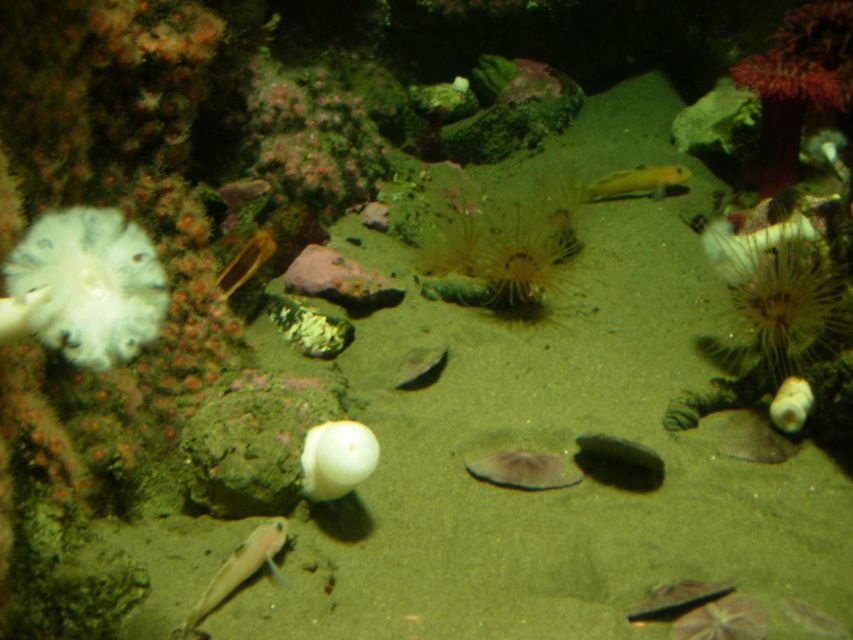
From the picture: Measure the distance between translucent pink fish at lower left and camera.

translucent pink fish at lower left is 1.30 meters away from camera.

Who is higher up, translucent pink fish at lower left or shiny silver fish at lower center?

translucent pink fish at lower left is higher up.

Describe the element at coordinates (236, 572) in the screenshot. This screenshot has height=640, width=853. I see `translucent pink fish at lower left` at that location.

Identify the location of translucent pink fish at lower left. This screenshot has height=640, width=853. (236, 572).

Can you confirm if white soft coral at left is positioned to the left of shiny silver fish at lower center?

Yes, white soft coral at left is to the left of shiny silver fish at lower center.

Is point (80, 326) more distant than point (679, 580)?

Yes, point (80, 326) is farther from viewer.

Find the location of `white soft coral at left`. white soft coral at left is located at coordinates (90, 284).

Does white matte coral at center appear on the left side of yellow-green glossy fish at upper right?

Yes, white matte coral at center is to the left of yellow-green glossy fish at upper right.

Who is more distant from viewer, (363, 480) or (648, 173)?

Positioned behind is point (648, 173).

What are the coordinates of `white matte coral at center` in the screenshot? It's located at (335, 458).